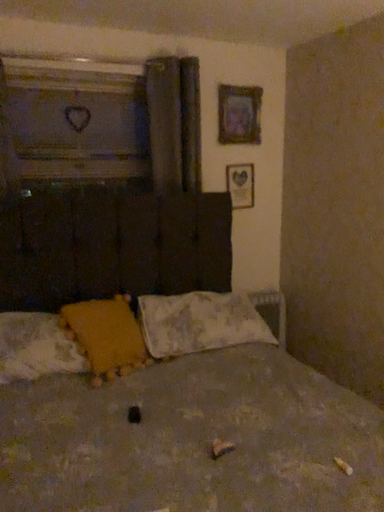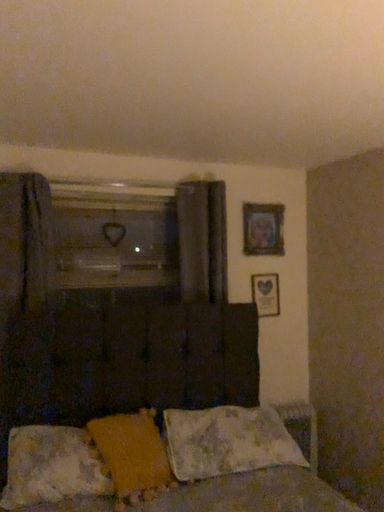
Question: Which way did the camera rotate in the video?

Choices:
 (A) rotated downward
 (B) rotated upward

Answer: (B)